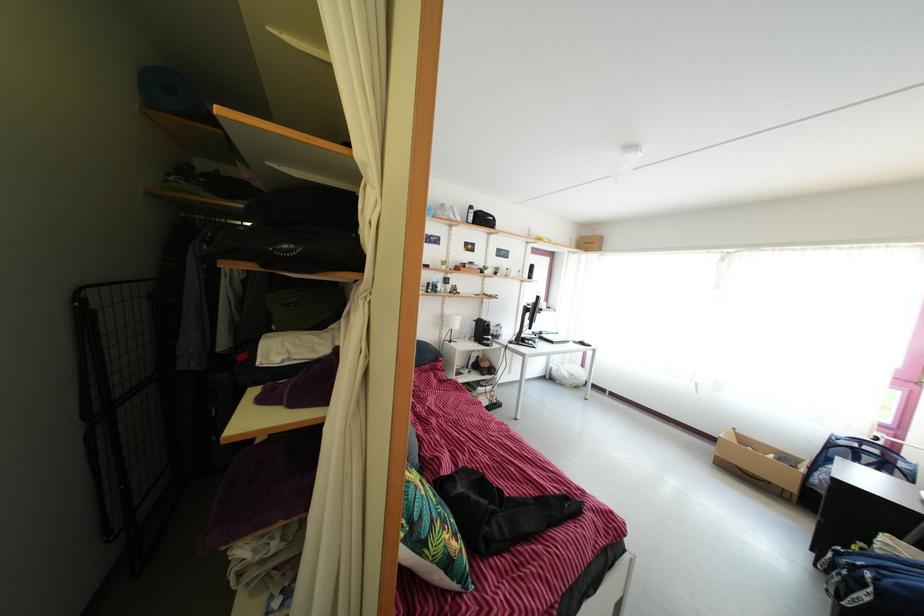
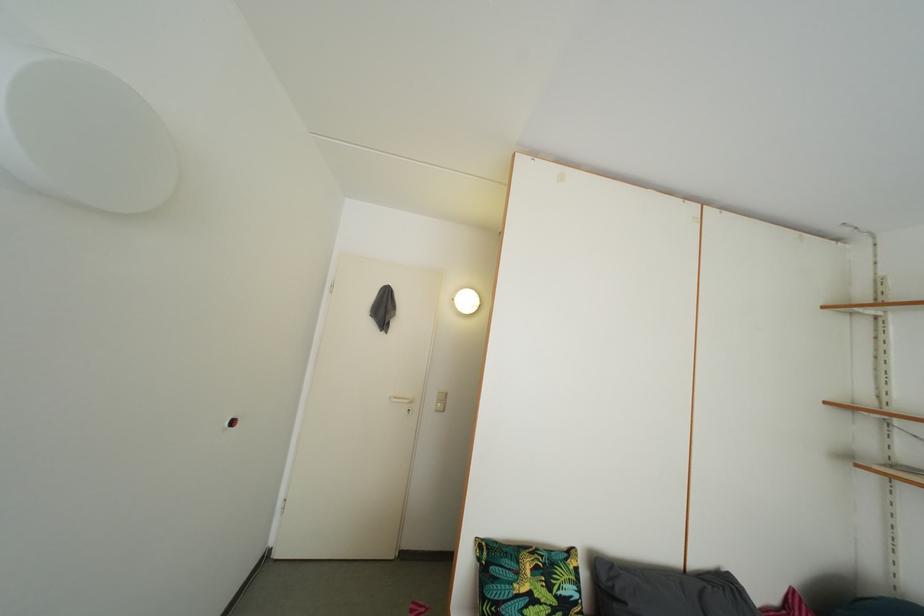
Question: I am providing you with two images of the same scene from different viewpoints. After the viewpoint changes to image2, which objects are now occluded?

Choices:
 (A) patterned green pillow
 (B) pink shopping bag
 (C) black drying rack
 (D) white light switch

Answer: (C)